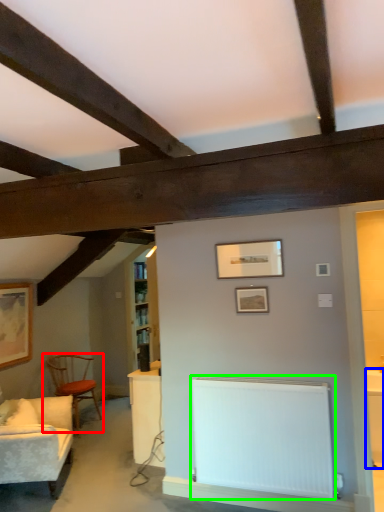
Question: Considering the real-world distances, which object is farthest from chair (highlighted by a red box)? table (highlighted by a blue box) or radiator (highlighted by a green box)?

Choices:
 (A) table
 (B) radiator

Answer: (A)